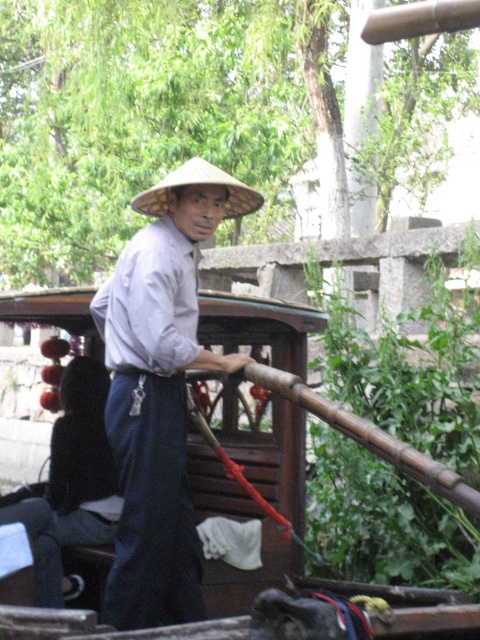
You are navigating a small wooden boat in a serene environment. You need to reach a point marked at coordinates (300, 404). According to the scene, where is the wooden boat located?

The wooden boat at center is located at point (300, 404).

You are a photographer trying to capture the light gray cotton shirt at center in the image. Based on its coordinates, where should you aim your camera?

The light gray cotton shirt at center is located at the coordinates point (159, 392), so aim your camera at that position to capture it.